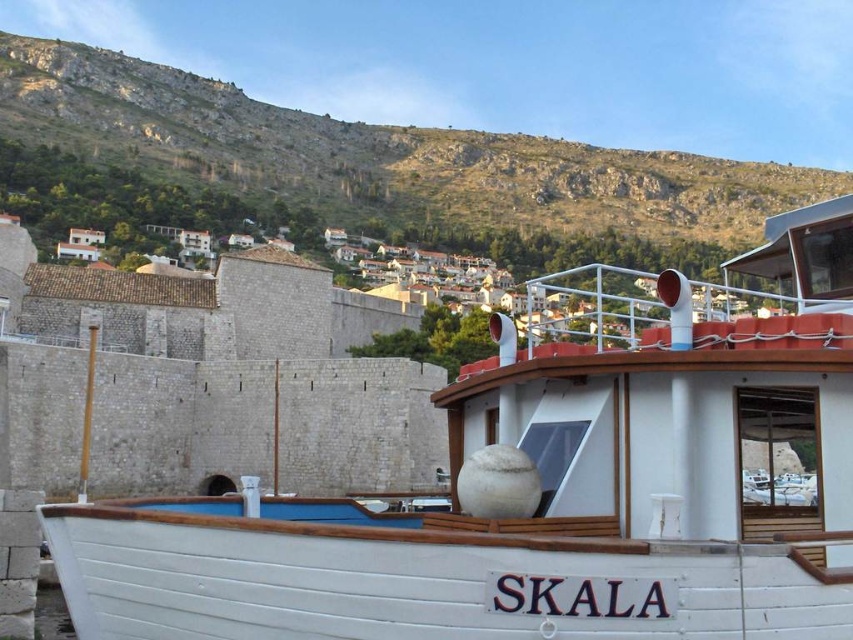
Can you confirm if white wooden boat at center is smaller than green grassy hillside at upper center?

Yes, white wooden boat at center is smaller than green grassy hillside at upper center.

Is point (849, 320) behind point (601, 212)?

No, it is in front of (601, 212).

Does point (355, 532) come in front of point (227, 152)?

Yes, point (355, 532) is closer to viewer.

Locate an element on the screen. The image size is (853, 640). white wooden boat at center is located at coordinates (549, 484).